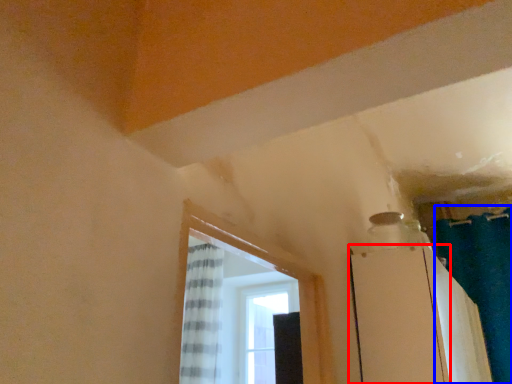
Question: Which point is closer to the camera, screen door (highlighted by a red box) or shower curtain (highlighted by a blue box)?

Choices:
 (A) screen door
 (B) shower curtain

Answer: (A)